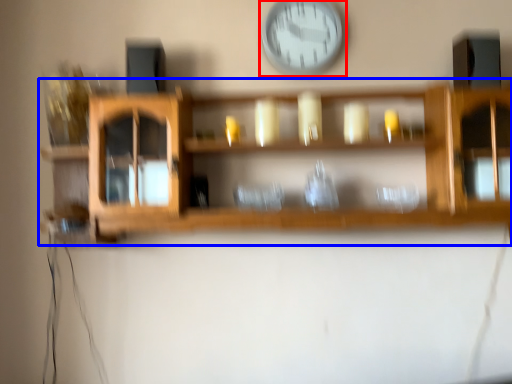
Question: Which point is further to the camera, wall clock (highlighted by a red box) or shelf (highlighted by a blue box)?

Choices:
 (A) wall clock
 (B) shelf

Answer: (A)